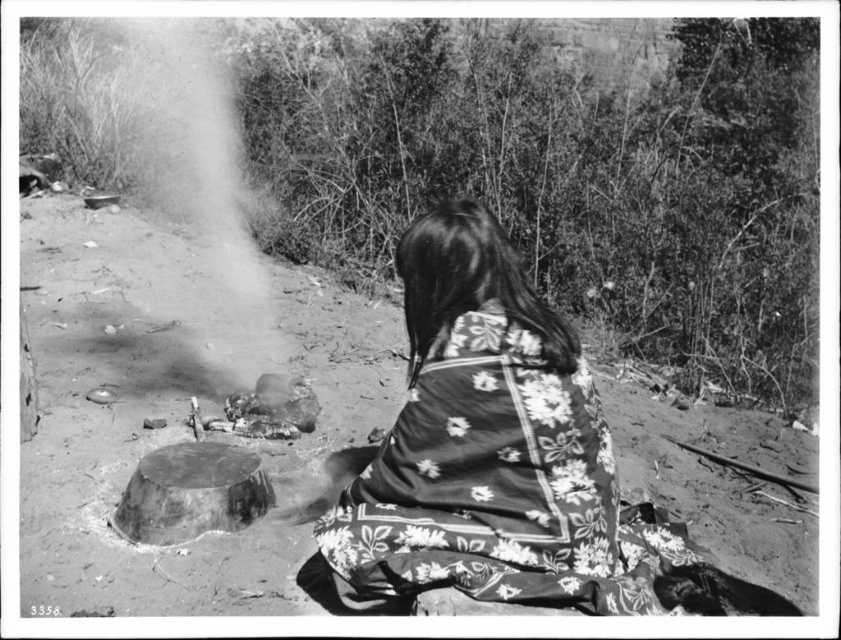
Question: Which of the following is the closest to the observer?

Choices:
 (A) (484, 344)
 (B) (141, 65)

Answer: (A)

Question: Can you confirm if floral fabric shawl at center is thinner than smoke/ash cloud at center?

Choices:
 (A) no
 (B) yes

Answer: (B)

Question: Which of the following is the closest to the observer?

Choices:
 (A) (424, 272)
 (B) (244, 280)

Answer: (A)

Question: Is floral fabric shawl at center positioned at the back of smoke/ash cloud at center?

Choices:
 (A) no
 (B) yes

Answer: (A)

Question: From the image, what is the correct spatial relationship of floral fabric shawl at center in relation to smoke/ash cloud at center?

Choices:
 (A) left
 (B) right

Answer: (B)

Question: Which object is farther from the camera taking this photo?

Choices:
 (A) smoke/ash cloud at center
 (B) floral fabric shawl at center

Answer: (A)